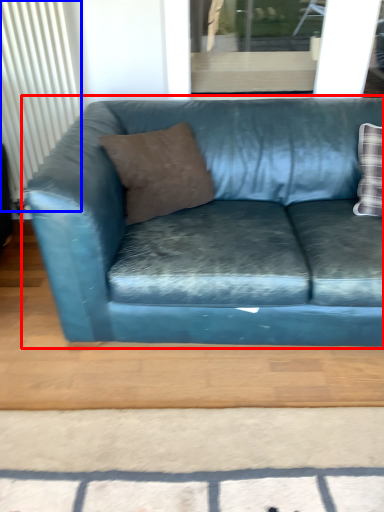
Question: Which of the following is the farthest to the observer, studio couch (highlighted by a red box) or radiator (highlighted by a blue box)?

Choices:
 (A) studio couch
 (B) radiator

Answer: (B)